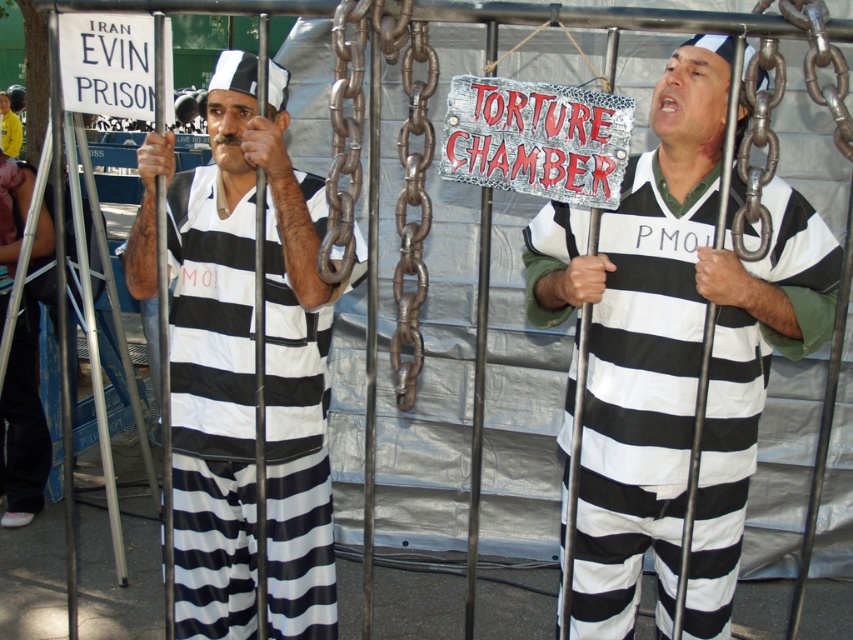
You are a security guard inspecting the prison area. You notice the matte black striped jumpsuit at left and the rusty metal chain at center. Which object is positioned lower in the scene?

The matte black striped jumpsuit at left is below the rusty metal chain at center, so it is positioned lower in the scene.

You are a prison guard who needs to ensure that inmates maintain a minimum distance of 3 feet between each other. You observe two inmates wearing matte black striped jumpsuit at center and matte black striped jumpsuit at left. Can you confirm if they are complying with the distancing rule?

The distance between the matte black striped jumpsuit at center and matte black striped jumpsuit at left is 33.88 inches. Since 3 feet equals 36 inches, they are not maintaining the required distance as 33.88 inches is less than 36 inches.

Looking at this image, you are a security guard observing the scene. You notice the matte black striped jumpsuit at left and the rusty metal chain at center. Which object is closer to the left edge of the image?

The matte black striped jumpsuit at left is positioned on the left side of the rusty metal chain at center, so it is closer to the left edge of the image.